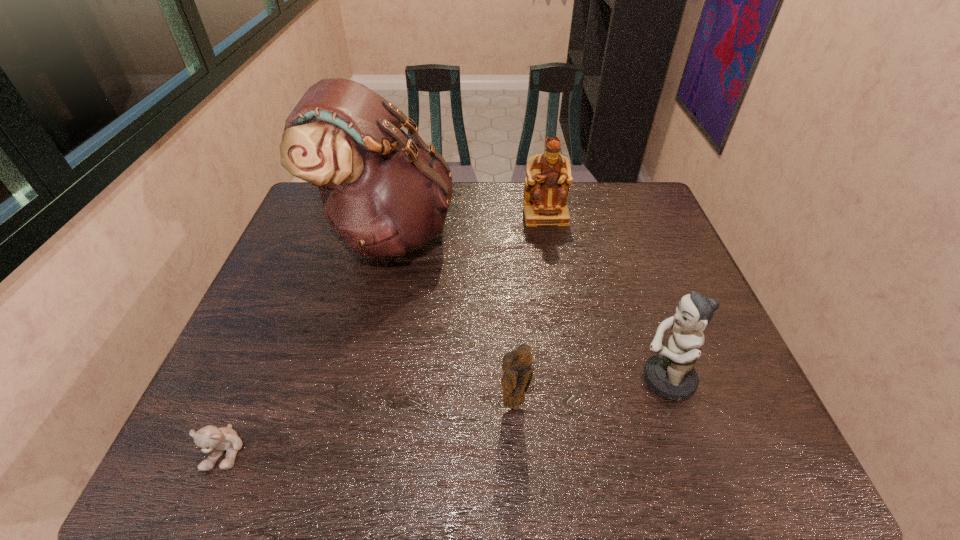
Identify which object is the third nearest to the shortest figurine. Please provide its 2D coordinates. Your answer should be formatted as a tuple, i.e. [(x, y)], where the tuple contains the x and y coordinates of a point satisfying the conditions above.

[(211, 439)]

Where is `figurine that is the second closest one to the leftmost figurine`? Image resolution: width=960 pixels, height=540 pixels. figurine that is the second closest one to the leftmost figurine is located at coordinates (546, 189).

Select which figurine is the second closest to the nearest object. Please provide its 2D coordinates. Your answer should be formatted as a tuple, i.e. [(x, y)], where the tuple contains the x and y coordinates of a point satisfying the conditions above.

[(670, 374)]

The width and height of the screenshot is (960, 540). Find the location of `vacant space that satisfies the following two spatial constraints: 1. on the front-facing side of the rightmost object; 2. on the face of the nearest object`. vacant space that satisfies the following two spatial constraints: 1. on the front-facing side of the rightmost object; 2. on the face of the nearest object is located at coordinates (689, 450).

The height and width of the screenshot is (540, 960). I want to click on vacant space that satisfies the following two spatial constraints: 1. on the front-facing side of the rightmost object; 2. on the face of the shortest object, so click(689, 450).

Locate an element on the screen. free space in the image that satisfies the following two spatial constraints: 1. at the front of the tallest object with buckles; 2. on the face of the teddy bear is located at coordinates (338, 450).

The image size is (960, 540). In order to click on free space that satisfies the following two spatial constraints: 1. on the front-facing side of the second figurine from left to right; 2. at the front of the satchel with buckles in this screenshot , I will do `click(548, 233)`.

Where is `vacant space that satisfies the following two spatial constraints: 1. on the front-facing side of the rightmost figurine; 2. on the face of the nearest object`? This screenshot has width=960, height=540. vacant space that satisfies the following two spatial constraints: 1. on the front-facing side of the rightmost figurine; 2. on the face of the nearest object is located at coordinates (689, 450).

Where is `blank area in the image that satisfies the following two spatial constraints: 1. on the front-facing side of the farthest figurine; 2. at the front of the satchel with buckles`? This screenshot has width=960, height=540. blank area in the image that satisfies the following two spatial constraints: 1. on the front-facing side of the farthest figurine; 2. at the front of the satchel with buckles is located at coordinates point(548,233).